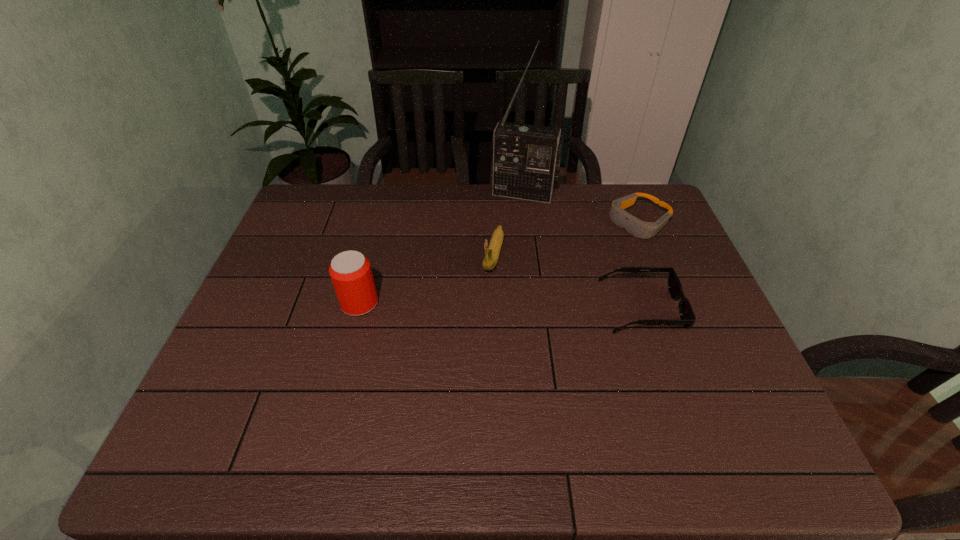
The image size is (960, 540). I want to click on free space on the desktop that is between the beer can and the sunglasses and is positioned on the display of the radio receiver, so click(x=489, y=306).

Locate an element on the screen. The width and height of the screenshot is (960, 540). free space on the desktop that is between the fourth shortest object and the sunglasses and is positioned at the stem of the third tallest object is located at coordinates (477, 306).

Locate an element on the screen. The image size is (960, 540). free space on the desktop that is between the leftmost object and the sunglasses and is positioned on the front and back of the goggles is located at coordinates (497, 306).